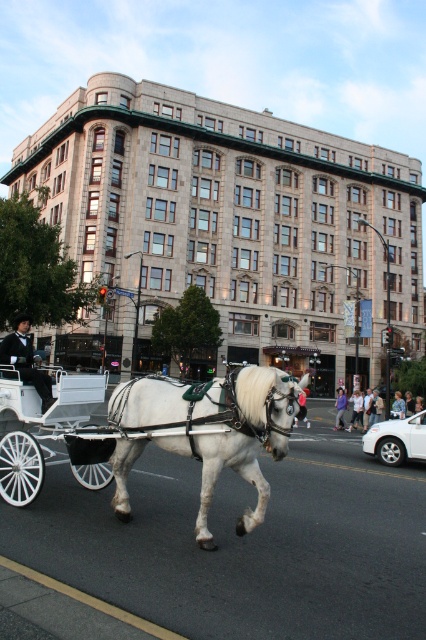
Does white polished wood cart at center appear on the left side of white leather coach at center?

No, white polished wood cart at center is not to the left of white leather coach at center.

Which is behind, point (92, 404) or point (28, 364)?

Positioned behind is point (28, 364).

Locate an element on the screen. The width and height of the screenshot is (426, 640). white polished wood cart at center is located at coordinates (40, 426).

Does white glossy horse at center have a lesser height compared to white leather coach at center?

Yes.

Is white glossy horse at center positioned behind white leather coach at center?

No.

Is point (233, 436) positioned in front of point (16, 364)?

Yes, it is.

I want to click on white glossy horse at center, so click(239, 436).

Is point (276, 420) closer to viewer compared to point (37, 394)?

Yes, point (276, 420) is in front of point (37, 394).

This screenshot has width=426, height=640. What do you see at coordinates (239, 436) in the screenshot?
I see `white glossy horse at center` at bounding box center [239, 436].

Image resolution: width=426 pixels, height=640 pixels. What do you see at coordinates (239, 436) in the screenshot? I see `white glossy horse at center` at bounding box center [239, 436].

Locate an element on the screen. white glossy horse at center is located at coordinates (239, 436).